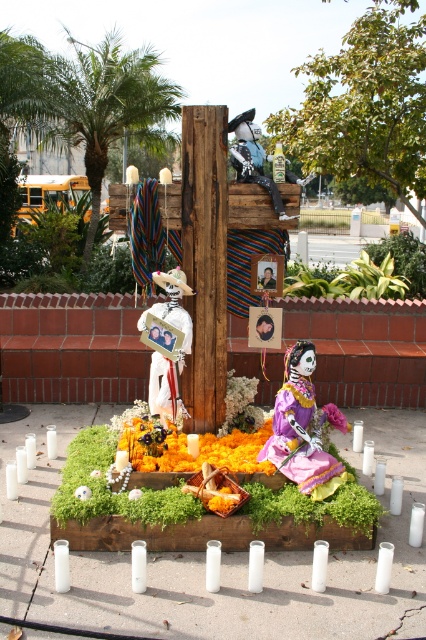
Question: Is matte purple fabric doll at center below white paper skull at center?

Choices:
 (A) no
 (B) yes

Answer: (B)

Question: Among these objects, which one is nearest to the camera?

Choices:
 (A) pink fabric flower at center
 (B) smooth wooden cross at center
 (C) white paper photo frame at center
 (D) white paper skull at center

Answer: (C)

Question: Based on their relative distances, which object is nearer to the pink fabric flower at center?

Choices:
 (A) matte white skeleton at center
 (B) matte plastic photo frame at center
 (C) smooth wooden cross at center
 (D) white paper photo frame at center

Answer: (B)

Question: Can you confirm if marigold petals at center is positioned to the left of pink fabric flower at center?

Choices:
 (A) no
 (B) yes

Answer: (B)

Question: Which object appears closest to the camera in this image?

Choices:
 (A) white paper photo frame at center
 (B) white paper skull at center
 (C) marigold petals at center
 (D) matte white skeleton at center

Answer: (C)

Question: Is marigold petals at center further to camera compared to pink fabric flower at center?

Choices:
 (A) yes
 (B) no

Answer: (B)